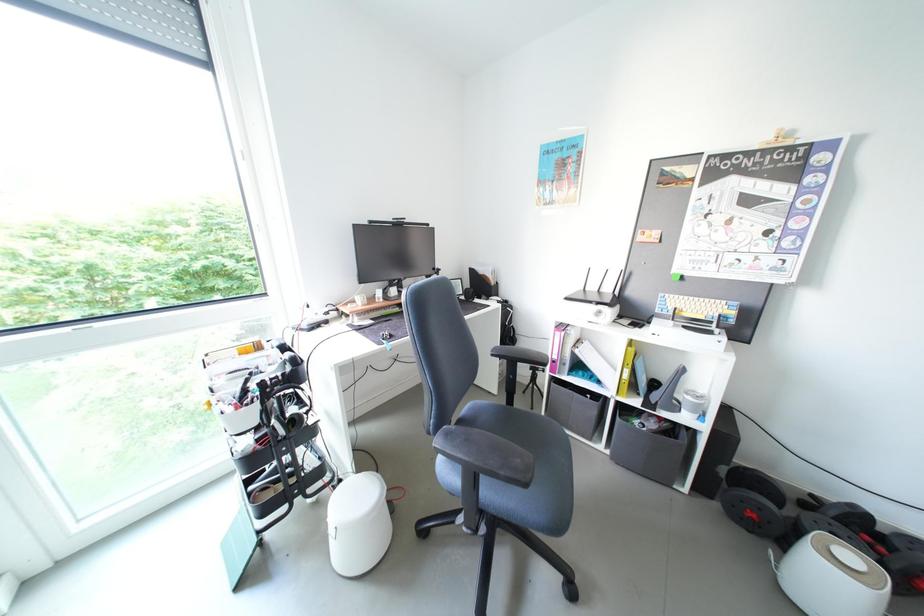
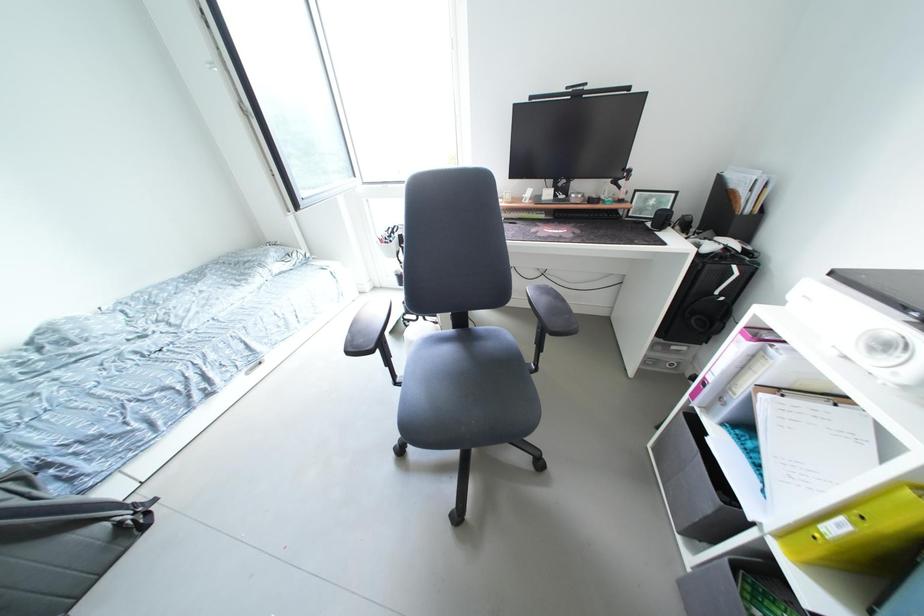
First-person continuous shooting, in which direction is the camera rotating?

The rotation direction of the camera is left-down.